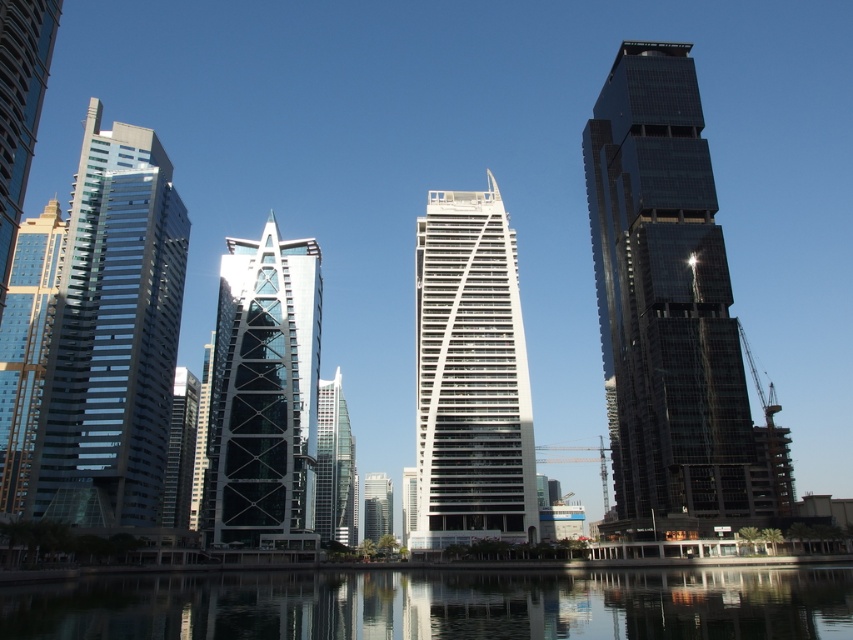
Question: Which of the following is the closest to the observer?

Choices:
 (A) (505, 253)
 (B) (375, 509)
 (C) (125, 176)

Answer: (A)

Question: Which point is farther to the camera?

Choices:
 (A) (416, 513)
 (B) (662, 452)

Answer: (A)

Question: Among these points, which one is farthest from the camera?

Choices:
 (A) (502, 470)
 (B) (329, 528)

Answer: (B)

Question: Considering the relative positions of transparent glass water at center and white glass building at center in the image provided, where is transparent glass water at center located with respect to white glass building at center?

Choices:
 (A) right
 (B) left

Answer: (A)

Question: Where is transparent glass water at center located in relation to white glass building at center in the image?

Choices:
 (A) right
 (B) left

Answer: (A)

Question: Does white glass building at center lie behind glassy reflective skyscraper at center?

Choices:
 (A) no
 (B) yes

Answer: (A)